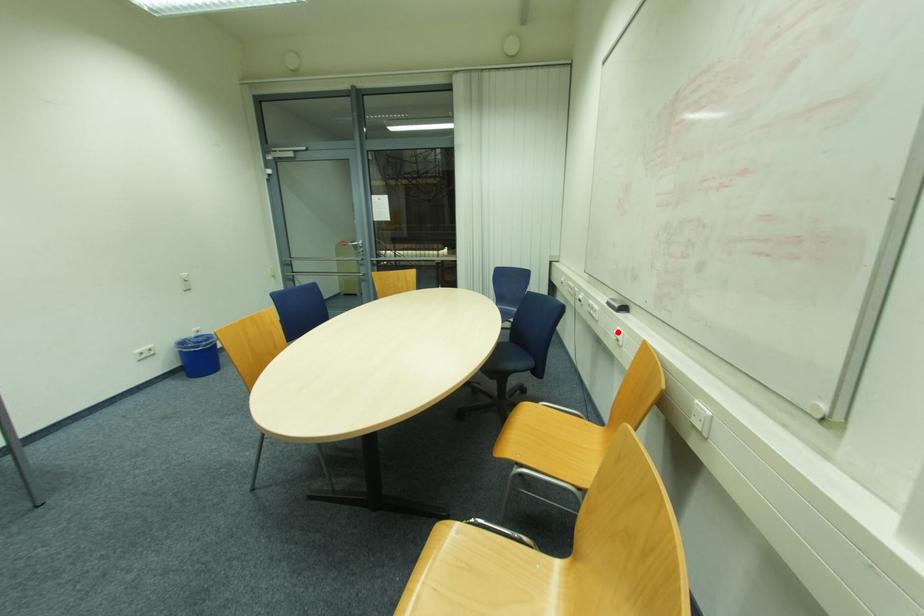
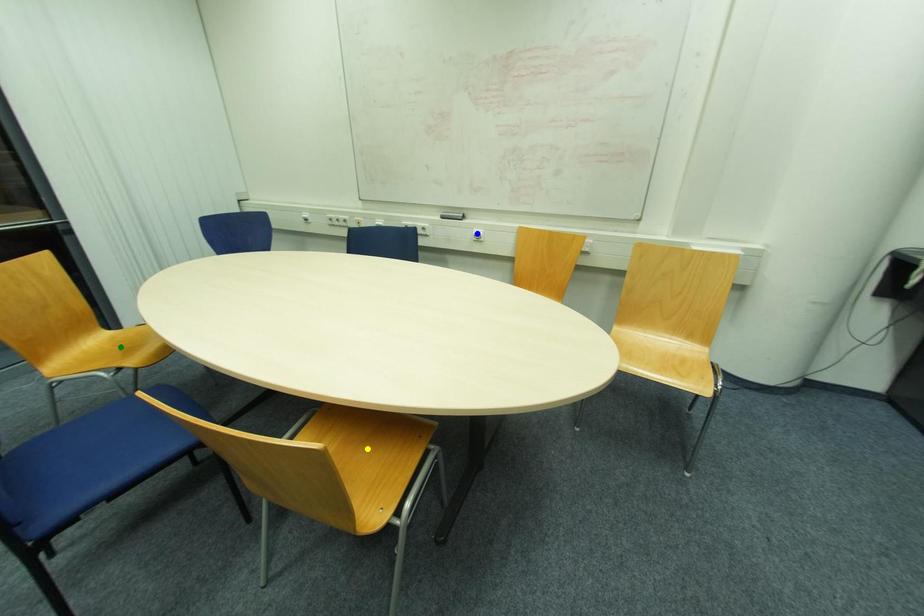
Question: I am providing you with two images of the same scene from different viewpoints. A red point is marked on the first image. You are given multiple points on the second image. Can you choose the point in image 2 that corresponds to the point in image 1?

Choices:
 (A) yellow point
 (B) blue point
 (C) green point

Answer: (B)